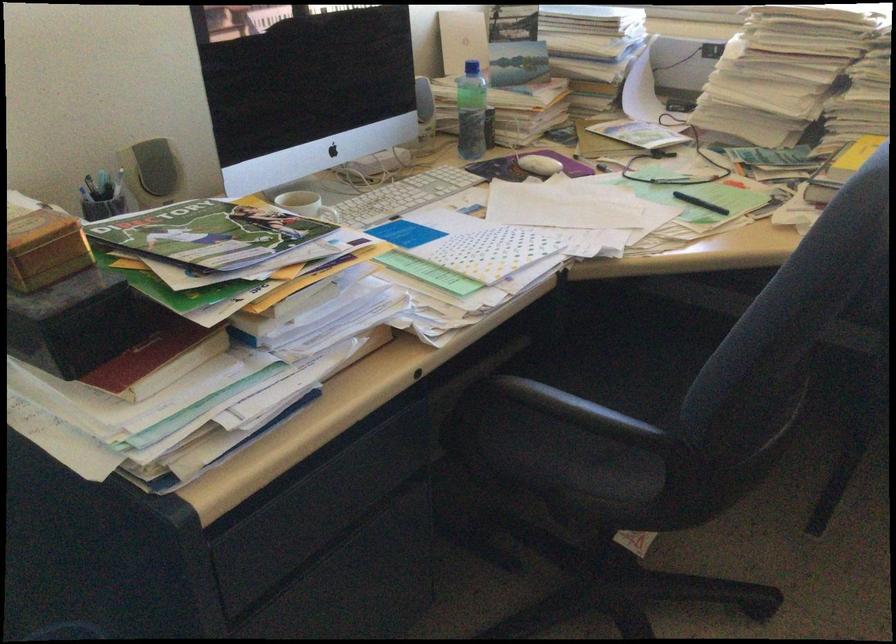
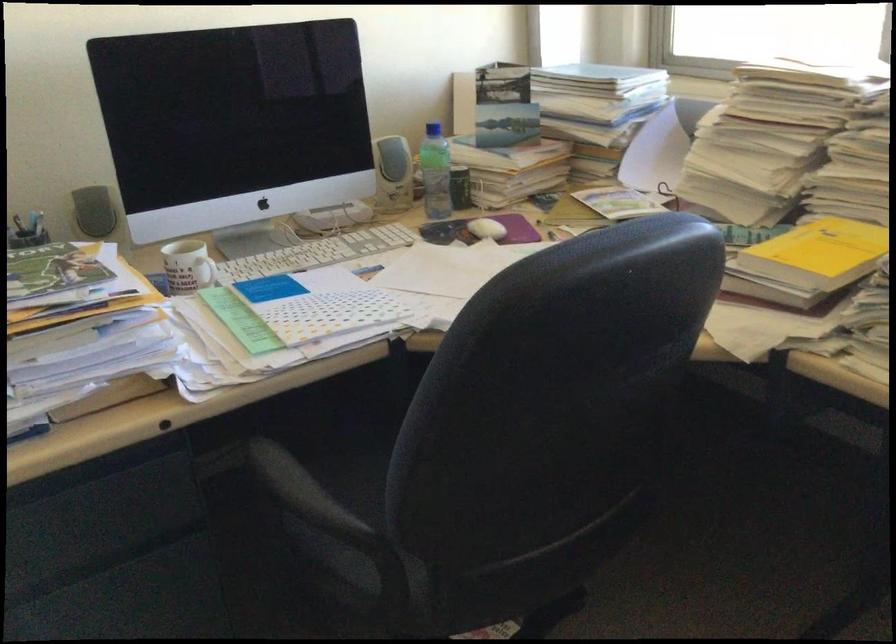
Question: I am providing you with two images of the same scene from different viewpoints. Please identify which objects are invisible in image2.

Choices:
 (A) chair sitting surface
 (B) yellow book
 (C) white computer mouse
 (D) dark flip-flop

Answer: (A)